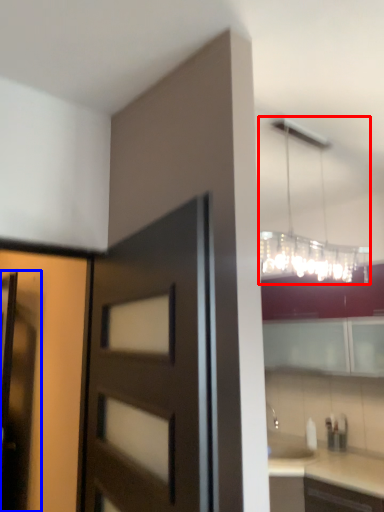
Question: Which object appears closest to the camera in this image, lamp (highlighted by a red box) or screen door (highlighted by a blue box)?

Choices:
 (A) lamp
 (B) screen door

Answer: (A)